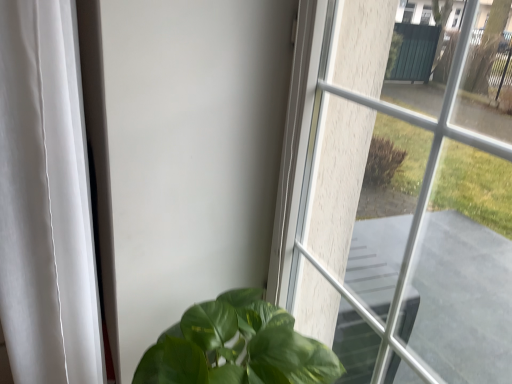
Measure the distance between white fabric curtain at left and camera.

white fabric curtain at left and camera are 28.68 inches apart.

What do you see at coordinates (45, 201) in the screenshot?
I see `white fabric curtain at left` at bounding box center [45, 201].

This screenshot has width=512, height=384. Find the location of `white fabric curtain at left`. white fabric curtain at left is located at coordinates (45, 201).

The image size is (512, 384). Describe the element at coordinates (394, 223) in the screenshot. I see `clear glass window at center` at that location.

This screenshot has width=512, height=384. What are the coordinates of `clear glass window at center` in the screenshot? It's located at (394, 223).

Locate an element on the screen. white fabric curtain at left is located at coordinates (45, 201).

Can you confirm if white fabric curtain at left is positioned to the right of clear glass window at center?

In fact, white fabric curtain at left is to the left of clear glass window at center.

Is white fabric curtain at left behind clear glass window at center?

Yes.

Is point (70, 161) behind point (392, 326)?

Yes, it is behind point (392, 326).

From the image's perspective, which one is positioned lower, white fabric curtain at left or clear glass window at center?

white fabric curtain at left appears lower in the image.

From a real-world perspective, is white fabric curtain at left on clear glass window at center?

→ No, from a real-world perspective, white fabric curtain at left is not over clear glass window at center

Considering the sizes of objects white fabric curtain at left and clear glass window at center in the image provided, who is thinner, white fabric curtain at left or clear glass window at center?

clear glass window at center is thinner.

In terms of height, does white fabric curtain at left look taller or shorter compared to clear glass window at center?

Clearly, white fabric curtain at left is taller compared to clear glass window at center.

Can you confirm if white fabric curtain at left is bigger than clear glass window at center?

Indeed, white fabric curtain at left has a larger size compared to clear glass window at center.

Is clear glass window at center a part of white fabric curtain at left?

Definitely not — clear glass window at center is not inside white fabric curtain at left.

Is white fabric curtain at left not close to clear glass window at center?

No, white fabric curtain at left is not far from clear glass window at center.

Is white fabric curtain at left positioned with its back to clear glass window at center?

white fabric curtain at left is not turned away from clear glass window at center.

You are a GUI agent. You are given a task and a screenshot of the screen. Output one action in this format:
    pyautogui.click(x=<x>, y=<y>)
    Task: Click on the window to the right of white fabric curtain at left
    
    Given the screenshot: What is the action you would take?
    pyautogui.click(x=394, y=223)

Which object is positioned more to the right, clear glass window at center or white fabric curtain at left?

clear glass window at center is more to the right.

Considering the positions of objects clear glass window at center and white fabric curtain at left in the image provided, who is behind, clear glass window at center or white fabric curtain at left?

white fabric curtain at left is further away from the camera.

Is point (393, 288) closer or farther from the camera than point (65, 371)?

Point (393, 288) is farther from the camera than point (65, 371).

From the image's perspective, is clear glass window at center below white fabric curtain at left?

No, from the image's perspective, clear glass window at center is not beneath white fabric curtain at left.

From a real-world perspective, between clear glass window at center and white fabric curtain at left, who is vertically lower?

In real-world perspective, white fabric curtain at left is lower.

Between clear glass window at center and white fabric curtain at left, which one has larger width?

Wider between the two is white fabric curtain at left.

Can you confirm if clear glass window at center is taller than white fabric curtain at left?

In fact, clear glass window at center may be shorter than white fabric curtain at left.

Which of these two, clear glass window at center or white fabric curtain at left, is bigger?

white fabric curtain at left is bigger.

Could white fabric curtain at left be considered to be inside clear glass window at center?

No, white fabric curtain at left is located outside of clear glass window at center.

Is clear glass window at center positioned far away from white fabric curtain at left?

clear glass window at center is actually quite close to white fabric curtain at left.

In the scene shown: Is clear glass window at center aimed at white fabric curtain at left?

Yes, clear glass window at center is aimed at white fabric curtain at left.

How much distance is there between clear glass window at center and white fabric curtain at left?

24.13 inches.

Image resolution: width=512 pixels, height=384 pixels. I want to click on window in front of the white fabric curtain at left, so click(394, 223).

Image resolution: width=512 pixels, height=384 pixels. I want to click on curtain lying behind the clear glass window at center, so click(45, 201).

Locate an element on the screen. This screenshot has height=384, width=512. curtain that is under the clear glass window at center (from a real-world perspective) is located at coordinates (45, 201).